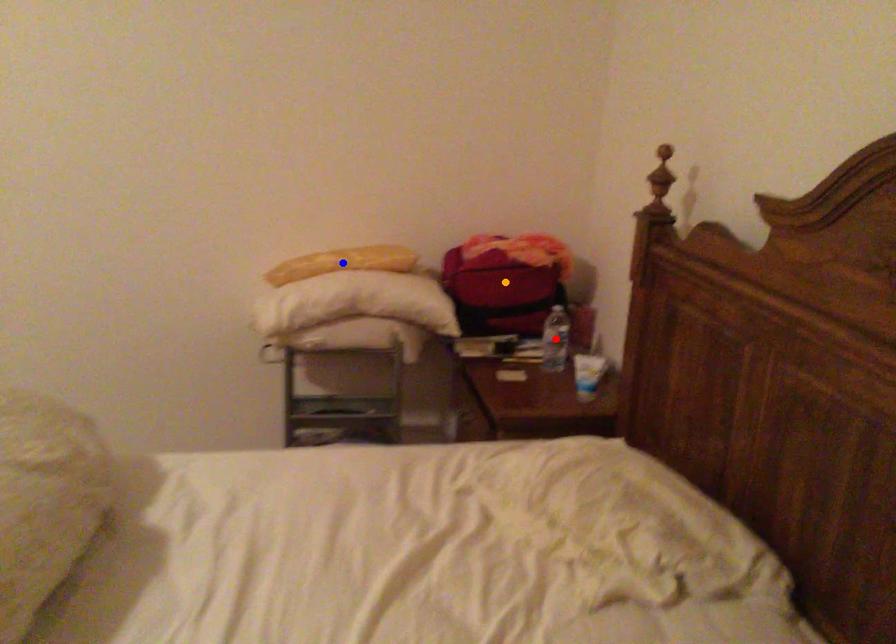
Order these from nearest to farthest:
1. red point
2. orange point
3. blue point

orange point
blue point
red point